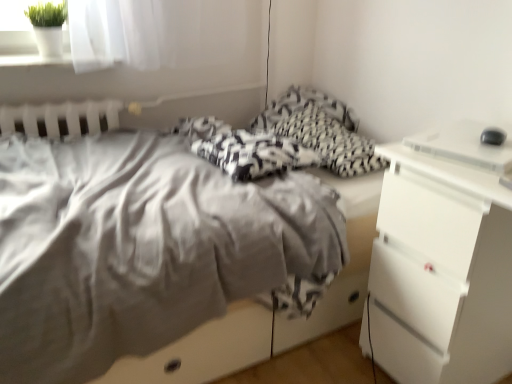
Question: Would you say white plastic desktop at right is a long distance from white plastic chest of drawers at right?

Choices:
 (A) yes
 (B) no

Answer: (B)

Question: From the image's perspective, is white plastic desktop at right beneath white plastic chest of drawers at right?

Choices:
 (A) yes
 (B) no

Answer: (B)

Question: Can you confirm if white plastic desktop at right is bigger than white plastic chest of drawers at right?

Choices:
 (A) no
 (B) yes

Answer: (A)

Question: Considering the relative positions of white plastic desktop at right and white plastic chest of drawers at right in the image provided, is white plastic desktop at right to the left of white plastic chest of drawers at right from the viewer's perspective?

Choices:
 (A) yes
 (B) no

Answer: (A)

Question: Does white plastic desktop at right have a greater width compared to white plastic chest of drawers at right?

Choices:
 (A) yes
 (B) no

Answer: (B)

Question: Considering the relative positions of matte gray bed at center and white plastic chest of drawers at right in the image provided, is matte gray bed at center to the left or to the right of white plastic chest of drawers at right?

Choices:
 (A) right
 (B) left

Answer: (B)

Question: From the image's perspective, is matte gray bed at center located above or below white plastic chest of drawers at right?

Choices:
 (A) below
 (B) above

Answer: (B)

Question: Is matte gray bed at center bigger or smaller than white plastic chest of drawers at right?

Choices:
 (A) big
 (B) small

Answer: (A)

Question: From a real-world perspective, is matte gray bed at center physically located above or below white plastic chest of drawers at right?

Choices:
 (A) above
 (B) below

Answer: (A)

Question: From a real-world perspective, is white plastic desktop at right physically located above or below matte gray bed at center?

Choices:
 (A) below
 (B) above

Answer: (B)

Question: Is point click(402, 140) positioned closer to the camera than point click(153, 349)?

Choices:
 (A) farther
 (B) closer

Answer: (A)

Question: Relative to matte gray bed at center, is white plastic desktop at right in front or behind?

Choices:
 (A) behind
 (B) front

Answer: (A)

Question: From the image's perspective, is white plastic desktop at right located above or below matte gray bed at center?

Choices:
 (A) below
 (B) above

Answer: (B)

Question: Considering the positions of white plastic desktop at right and white plastic chest of drawers at right in the image, is white plastic desktop at right taller or shorter than white plastic chest of drawers at right?

Choices:
 (A) tall
 (B) short

Answer: (B)

Question: Visually, is white plastic desktop at right positioned to the left or to the right of white plastic chest of drawers at right?

Choices:
 (A) left
 (B) right

Answer: (A)